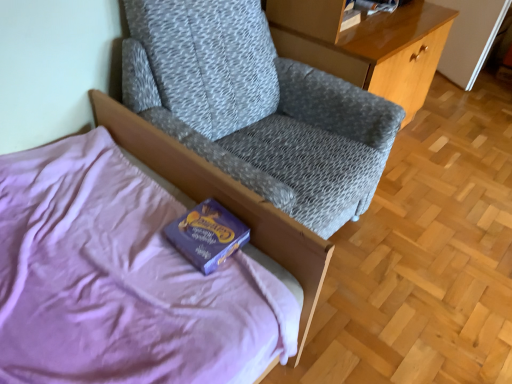
Question: Can we say purple matte paperback book at lower left lies outside textured gray fabric chair at upper center?

Choices:
 (A) no
 (B) yes

Answer: (B)

Question: Is purple matte paperback book at lower left positioned before textured gray fabric chair at upper center?

Choices:
 (A) no
 (B) yes

Answer: (A)

Question: Can you confirm if purple matte paperback book at lower left is taller than textured gray fabric chair at upper center?

Choices:
 (A) no
 (B) yes

Answer: (A)

Question: Considering the relative sizes of purple matte paperback book at lower left and textured gray fabric chair at upper center in the image provided, is purple matte paperback book at lower left smaller than textured gray fabric chair at upper center?

Choices:
 (A) no
 (B) yes

Answer: (B)

Question: Is purple matte paperback book at lower left at the left side of textured gray fabric chair at upper center?

Choices:
 (A) yes
 (B) no

Answer: (A)

Question: From a real-world perspective, is purple matte paperback book at lower left physically above textured gray fabric chair at upper center?

Choices:
 (A) yes
 (B) no

Answer: (B)

Question: Is textured gray fabric chair at upper center facing towards wooden glossy desk at upper right?

Choices:
 (A) yes
 (B) no

Answer: (B)

Question: Can you confirm if textured gray fabric chair at upper center is smaller than wooden glossy desk at upper right?

Choices:
 (A) yes
 (B) no

Answer: (B)

Question: Is the position of textured gray fabric chair at upper center less distant than that of wooden glossy desk at upper right?

Choices:
 (A) yes
 (B) no

Answer: (A)

Question: Is textured gray fabric chair at upper center looking in the opposite direction of wooden glossy desk at upper right?

Choices:
 (A) yes
 (B) no

Answer: (B)

Question: From the image's perspective, is textured gray fabric chair at upper center located beneath wooden glossy desk at upper right?

Choices:
 (A) yes
 (B) no

Answer: (A)

Question: From a real-world perspective, is textured gray fabric chair at upper center physically above wooden glossy desk at upper right?

Choices:
 (A) yes
 (B) no

Answer: (A)

Question: Is wooden glossy desk at upper right turned away from textured gray fabric chair at upper center?

Choices:
 (A) no
 (B) yes

Answer: (A)